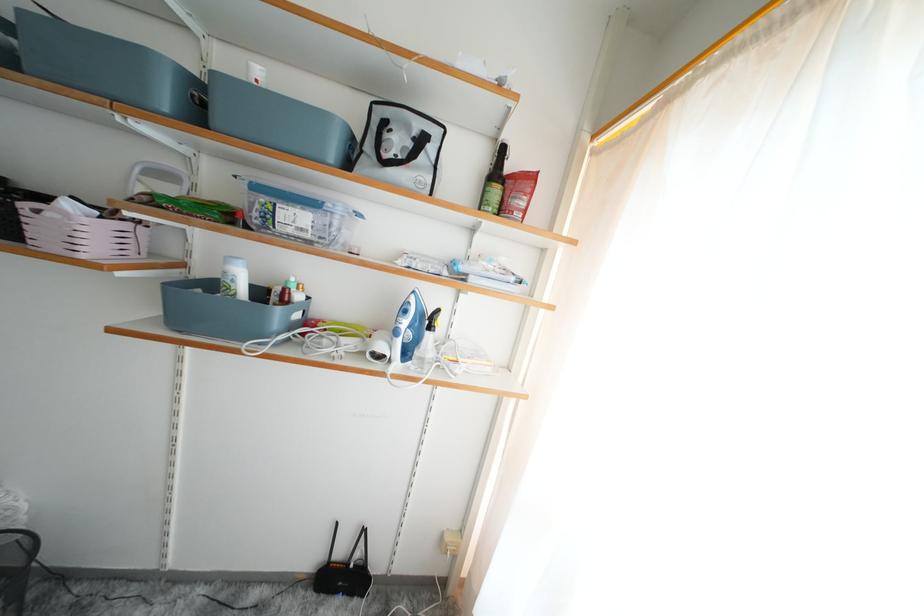
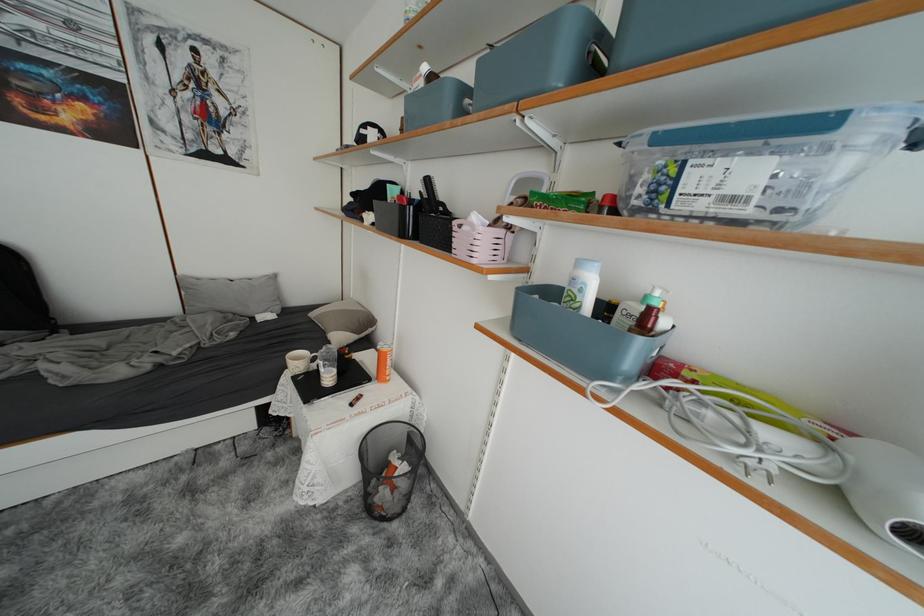
Locate, in the second image, the point that corresponds to (x=238, y=285) in the first image.

(588, 294)